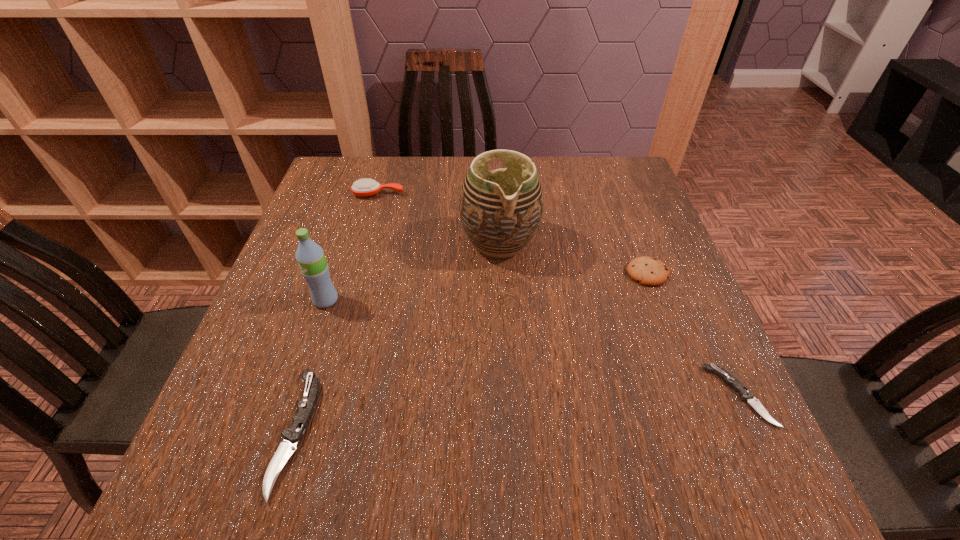
Image resolution: width=960 pixels, height=540 pixels. I want to click on location for an additional pocketknife to make spacing equal, so click(524, 414).